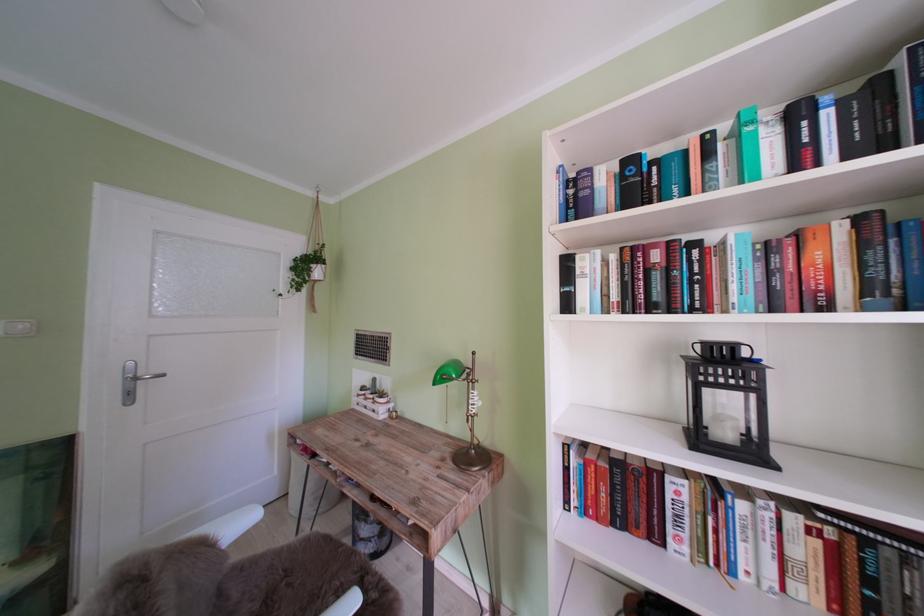
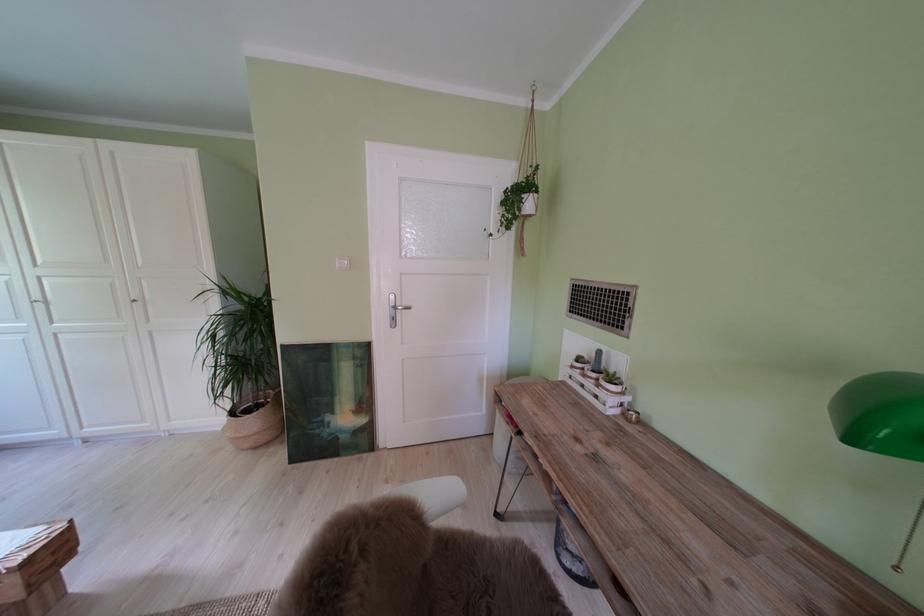
Where in the second image is the point corresponding to (320,281) from the first image?

(530, 215)